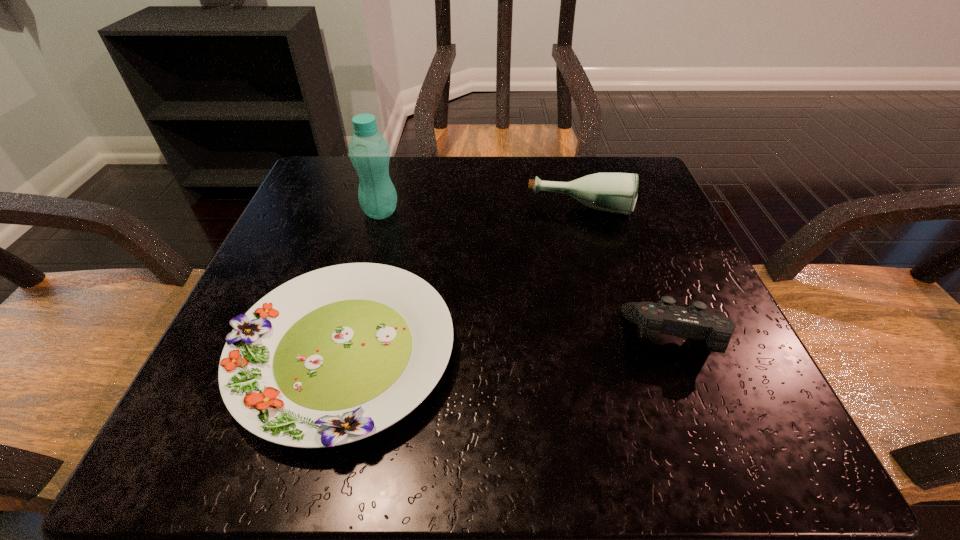
At what (x,y) coordinates should I click in order to perform the action: click on free space between the right bottle and the left bottle. Please return your answer as a coordinate pair (x, y). The width and height of the screenshot is (960, 540). Looking at the image, I should click on (480, 211).

Where is `blank region between the right bottle and the shortest object`? The height and width of the screenshot is (540, 960). blank region between the right bottle and the shortest object is located at coordinates (462, 281).

At what (x,y) coordinates should I click in order to perform the action: click on unoccupied area between the right bottle and the control. Please return your answer as a coordinate pair (x, y). Looking at the image, I should click on (629, 274).

Choose which object is the nearest neighbor to the shorter bottle. Please provide its 2D coordinates. Your answer should be formatted as a tuple, i.e. [(x, y)], where the tuple contains the x and y coordinates of a point satisfying the conditions above.

[(335, 355)]

The height and width of the screenshot is (540, 960). I want to click on object that is the closest to the shortest object, so click(x=369, y=152).

Find the location of a particular element. vacant space that satisfies the following two spatial constraints: 1. on the front side of the control; 2. on the left side of the right bottle is located at coordinates (615, 338).

You are a GUI agent. You are given a task and a screenshot of the screen. Output one action in this format:
    pyautogui.click(x=<x>, y=<y>)
    Task: Click on the vacant region that satisfies the following two spatial constraints: 1. on the back side of the control; 2. on the right side of the shortest object
    The image size is (960, 540).
    Given the screenshot: What is the action you would take?
    pyautogui.click(x=348, y=338)

Where is `free spot that satisfies the following two spatial constraints: 1. on the back side of the right bottle; 2. on the right side of the shortest object`? free spot that satisfies the following two spatial constraints: 1. on the back side of the right bottle; 2. on the right side of the shortest object is located at coordinates (382, 209).